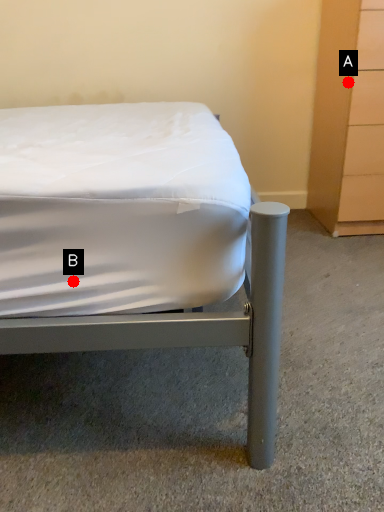
Question: Two points are circled on the image, labeled by A and B beside each circle. Which point appears closest to the camera in this image?

Choices:
 (A) A is closer
 (B) B is closer

Answer: (B)